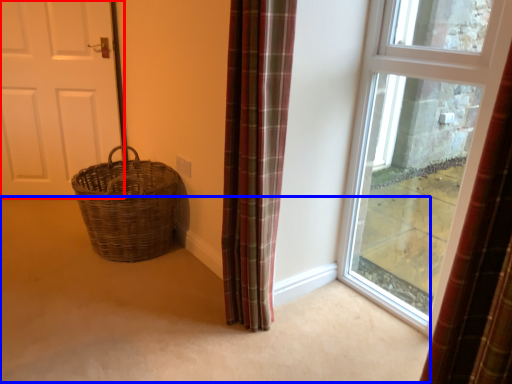
Question: Which object appears farthest to the camera in this image, door (highlighted by a red box) or corridor (highlighted by a blue box)?

Choices:
 (A) door
 (B) corridor

Answer: (A)